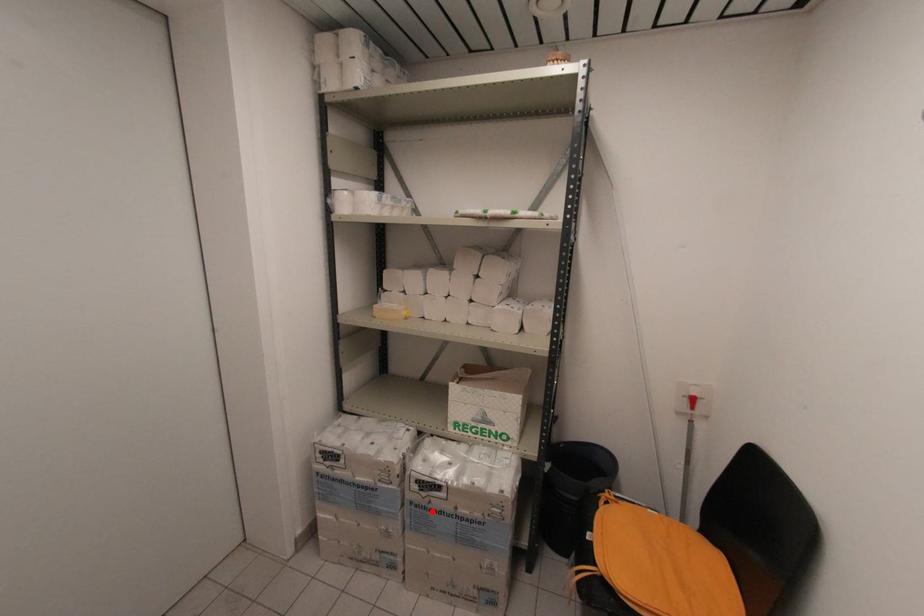
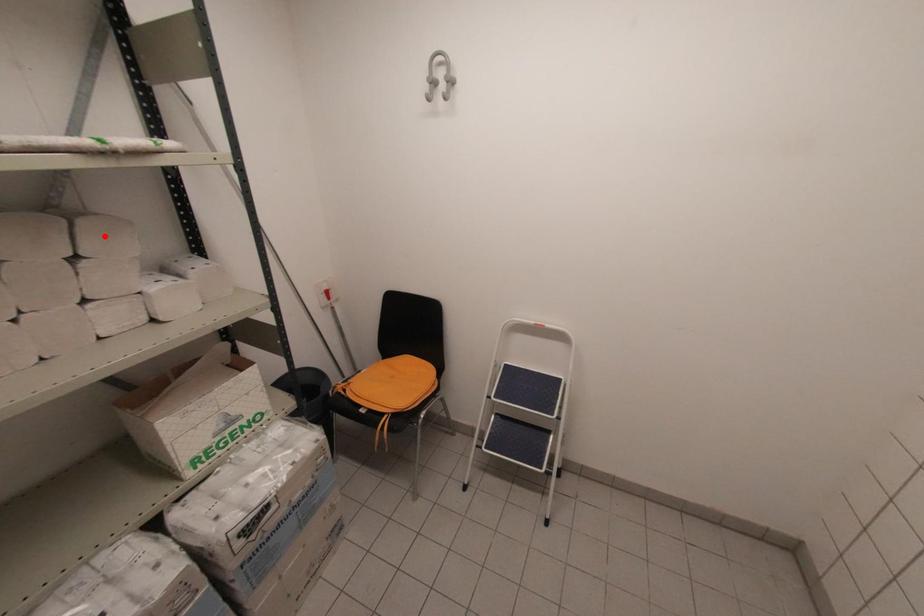
I am providing you with two images of the same scene from different viewpoints. A red point is marked on the first image and another point is marked on the second image. Do the highlighted points in image1 and image2 indicate the same real-world spot?

No